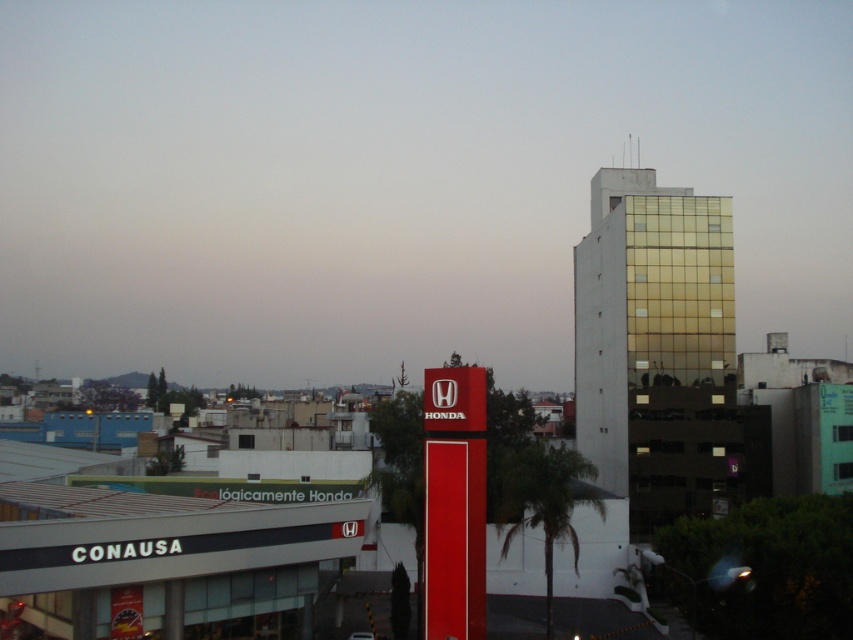
Question: Among these points, which one is farthest from the camera?

Choices:
 (A) (704, 35)
 (B) (518, 458)

Answer: (A)

Question: Does red glossy sign at center have a lesser width compared to green leafy palm tree at center?

Choices:
 (A) no
 (B) yes

Answer: (A)

Question: Is red glossy sign at center further to camera compared to green leafy palm tree at center?

Choices:
 (A) no
 (B) yes

Answer: (B)

Question: Which point is farther to the camera?

Choices:
 (A) green leafy palm tree at center
 (B) gold glass building at center

Answer: (B)

Question: Considering the real-world distances, which object is farthest from the green leafy palm tree at center?

Choices:
 (A) red glossy sign at center
 (B) gold glass building at center

Answer: (A)

Question: From the image, what is the correct spatial relationship of gold glass building at center in relation to green leafy palm tree at center?

Choices:
 (A) left
 (B) right

Answer: (B)